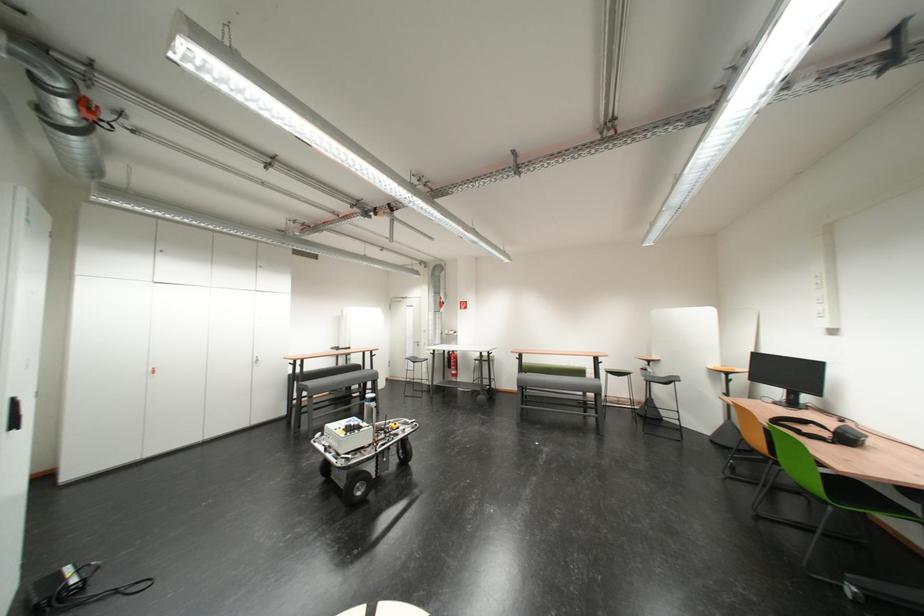
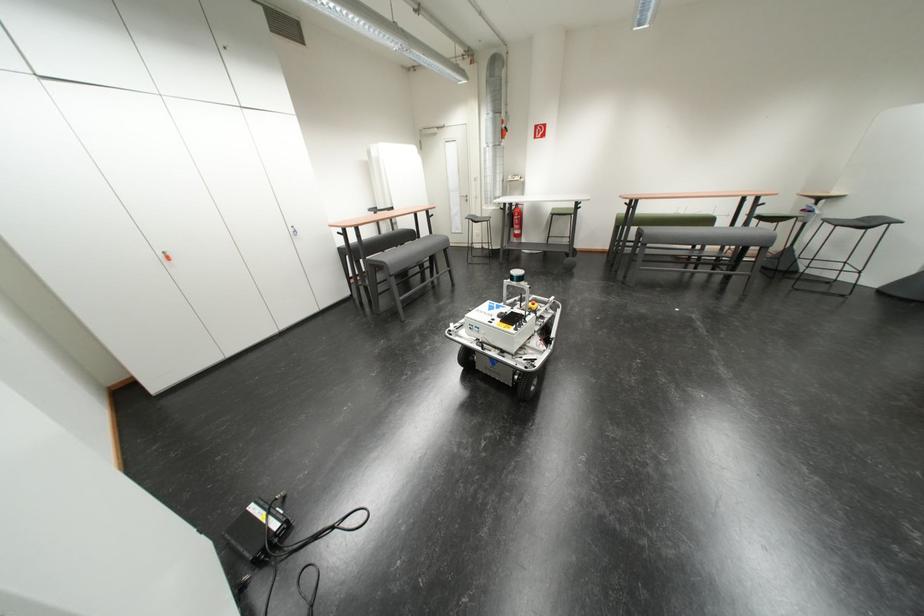
Where in the second image is the point corresponding to [442,355] from the first image?

(512, 211)